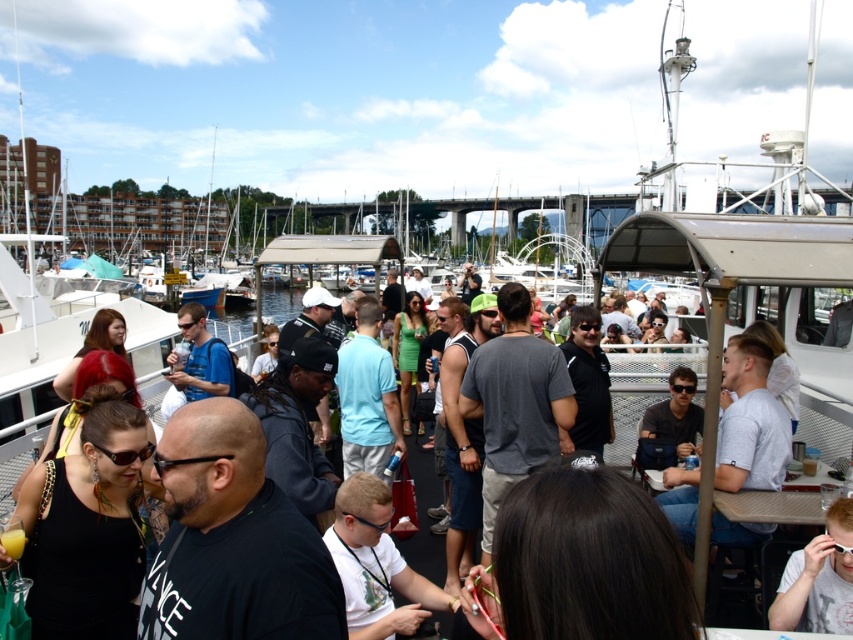
Does dark brown hair at lower center appear over matte blue shirt at center?

Actually, dark brown hair at lower center is below matte blue shirt at center.

Can you confirm if dark brown hair at lower center is shorter than matte blue shirt at center?

Incorrect, dark brown hair at lower center's height does not fall short of matte blue shirt at center's.

Describe the element at coordinates (581, 563) in the screenshot. The width and height of the screenshot is (853, 640). I see `dark brown hair at lower center` at that location.

The width and height of the screenshot is (853, 640). Identify the location of dark brown hair at lower center. (581, 563).

Consider the image. Can you confirm if light brown wooden table at lower right is positioned to the right of matte black sunglasses at center?

Indeed, light brown wooden table at lower right is positioned on the right side of matte black sunglasses at center.

Which is in front, point (805, 560) or point (694, 387)?

Point (805, 560) is more forward.

Who is more distant from viewer, (805, 593) or (682, 371)?

Positioned behind is point (682, 371).

The width and height of the screenshot is (853, 640). In order to click on light brown wooden table at lower right in this screenshot , I will do coord(819,579).

Is point (488, 388) farther from camera compared to point (662, 444)?

That is True.

Can you confirm if gray matte t-shirt at center is positioned above matte black sunglasses at center?

Correct, gray matte t-shirt at center is located above matte black sunglasses at center.

Which is behind, point (544, 396) or point (689, 380)?

Positioned behind is point (689, 380).

The height and width of the screenshot is (640, 853). What are the coordinates of `gray matte t-shirt at center` in the screenshot? It's located at (514, 403).